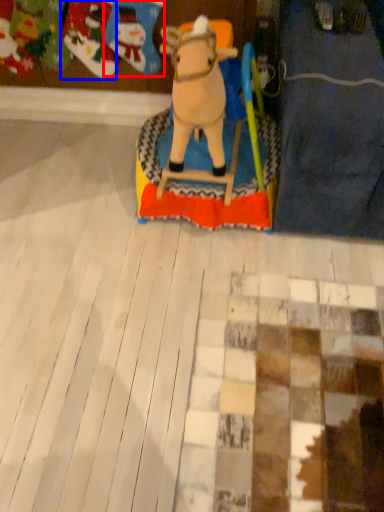
Question: Which point is closer to the camera, toy (highlighted by a red box) or toy (highlighted by a blue box)?

Choices:
 (A) toy
 (B) toy

Answer: (A)